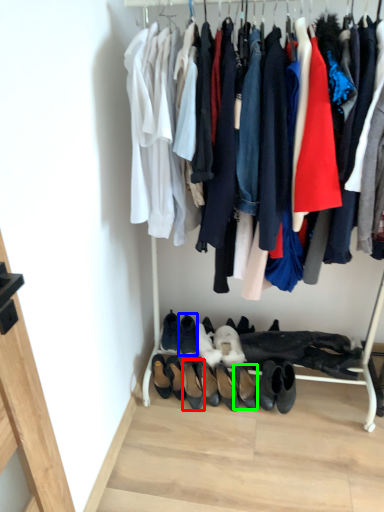
Question: Based on their relative distances, which object is nearer to footwear (highlighted by a red box)? Choose from footwear (highlighted by a blue box) and footwear (highlighted by a green box).

Choices:
 (A) footwear
 (B) footwear

Answer: (A)